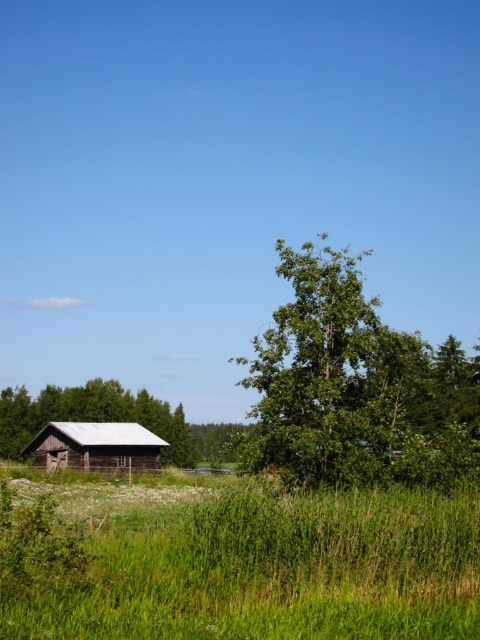
Does green rough wood house at lower left have a larger size compared to rustic wooden barn at lower left?

Indeed, green rough wood house at lower left has a larger size compared to rustic wooden barn at lower left.

The image size is (480, 640). What do you see at coordinates (93, 416) in the screenshot?
I see `green rough wood house at lower left` at bounding box center [93, 416].

This screenshot has width=480, height=640. Find the location of `green rough wood house at lower left`. green rough wood house at lower left is located at coordinates (93, 416).

Between green leafy tree at center and green rough wood house at lower left, which one appears on the right side from the viewer's perspective?

green leafy tree at center is more to the right.

Which is behind, point (309, 346) or point (11, 435)?

The point (11, 435) is more distant.

Locate an element on the screen. green leafy tree at center is located at coordinates (355, 388).

Is point (144, 497) farther from viewer compared to point (444, 456)?

Yes, point (144, 497) is behind point (444, 456).

Between green grassy at lower left and green leafy tree at center, which one appears on the left side from the viewer's perspective?

green grassy at lower left is more to the left.

Measure the distance between point (95, 566) and camera.

Point (95, 566) and camera are 27.40 feet apart from each other.

At what (x,y) coordinates should I click in order to perform the action: click on green grassy at lower left. Please return your answer as a coordinate pair (x, y). This screenshot has height=640, width=480. Looking at the image, I should click on (235, 561).